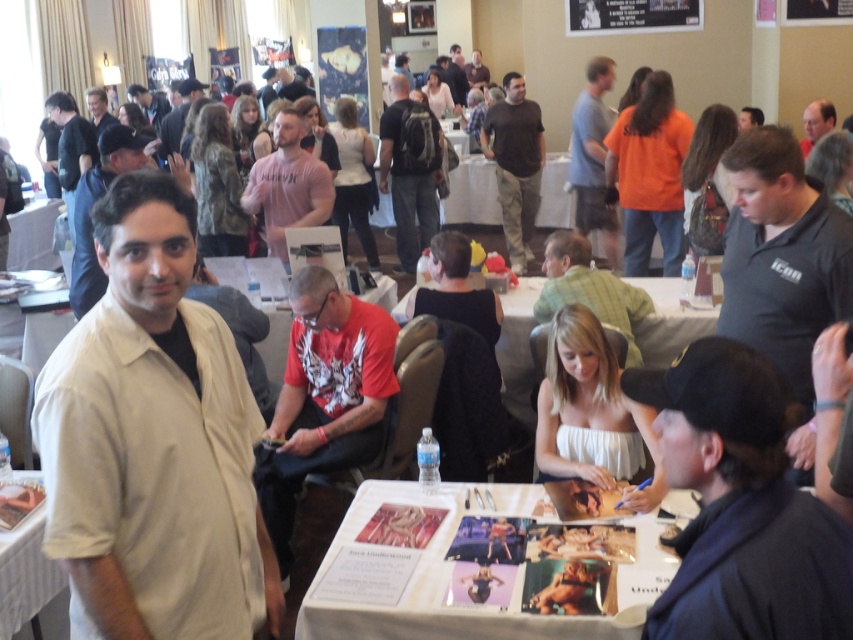
Which is behind, point (775, 332) or point (279, 150)?

The point (279, 150) is more distant.

Does point (809, 250) come farther from viewer compared to point (260, 157)?

No, (809, 250) is closer to viewer.

This screenshot has width=853, height=640. I want to click on black matte shirt at right, so click(x=781, y=253).

The width and height of the screenshot is (853, 640). I want to click on black matte shirt at right, so click(781, 253).

Is point (791, 273) behind point (62, 602)?

No.

Can you confirm if black matte shirt at right is smaller than white paper at lower left?

No, black matte shirt at right is not smaller than white paper at lower left.

Describe the element at coordinates (781, 253) in the screenshot. I see `black matte shirt at right` at that location.

The width and height of the screenshot is (853, 640). What are the coordinates of `black matte shirt at right` in the screenshot? It's located at (781, 253).

Looking at this image, does matte beige shirt at center appear on the left side of dark gray shirt at upper left?

Incorrect, matte beige shirt at center is not on the left side of dark gray shirt at upper left.

Does point (114, 148) lie in front of point (134, 100)?

Yes, it is.

The image size is (853, 640). What are the coordinates of `matte beige shirt at center` in the screenshot? It's located at (91, 205).

Identify the location of matte beige shirt at center. (91, 205).